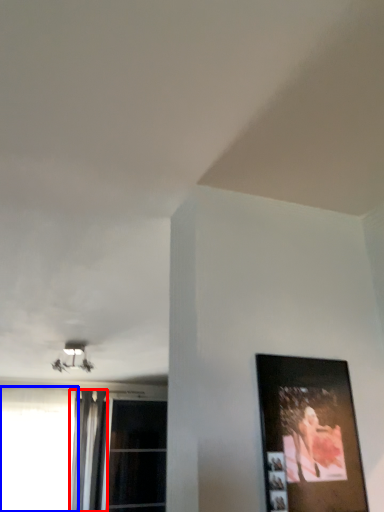
Question: Which object is closer to the camera taking this photo, curtain (highlighted by a red box) or window (highlighted by a blue box)?

Choices:
 (A) curtain
 (B) window

Answer: (B)